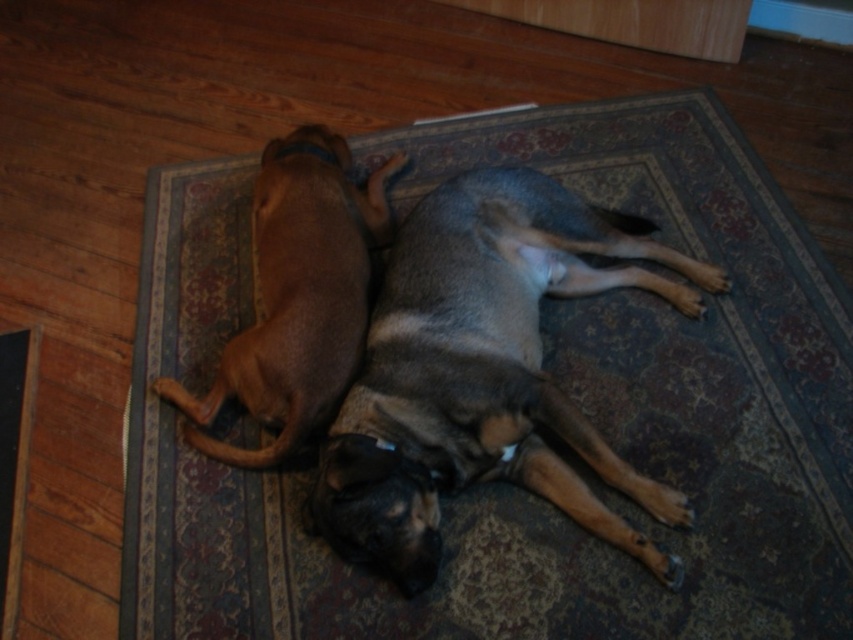
Does carpeted rug at center come in front of gray fur dog at center?

No, carpeted rug at center is behind gray fur dog at center.

At what (x,y) coordinates should I click in order to perform the action: click on carpeted rug at center. Please return your answer as a coordinate pair (x, y). This screenshot has height=640, width=853. Looking at the image, I should click on (553, 442).

I want to click on carpeted rug at center, so click(553, 442).

How distant is carpeted rug at center from brown matte dog at upper left?

carpeted rug at center is 10.87 inches from brown matte dog at upper left.

Does carpeted rug at center appear on the left side of brown matte dog at upper left?

Incorrect, carpeted rug at center is not on the left side of brown matte dog at upper left.

Is point (769, 461) positioned in front of point (276, 221)?

That is True.

I want to click on carpeted rug at center, so click(x=553, y=442).

Who is shorter, gray fur dog at center or brown matte dog at upper left?

Standing shorter between the two is brown matte dog at upper left.

Can you confirm if gray fur dog at center is positioned to the left of brown matte dog at upper left?

No, gray fur dog at center is not to the left of brown matte dog at upper left.

Does point (456, 218) lie in front of point (329, 260)?

Yes.

Locate an element on the screen. Image resolution: width=853 pixels, height=640 pixels. gray fur dog at center is located at coordinates (485, 372).